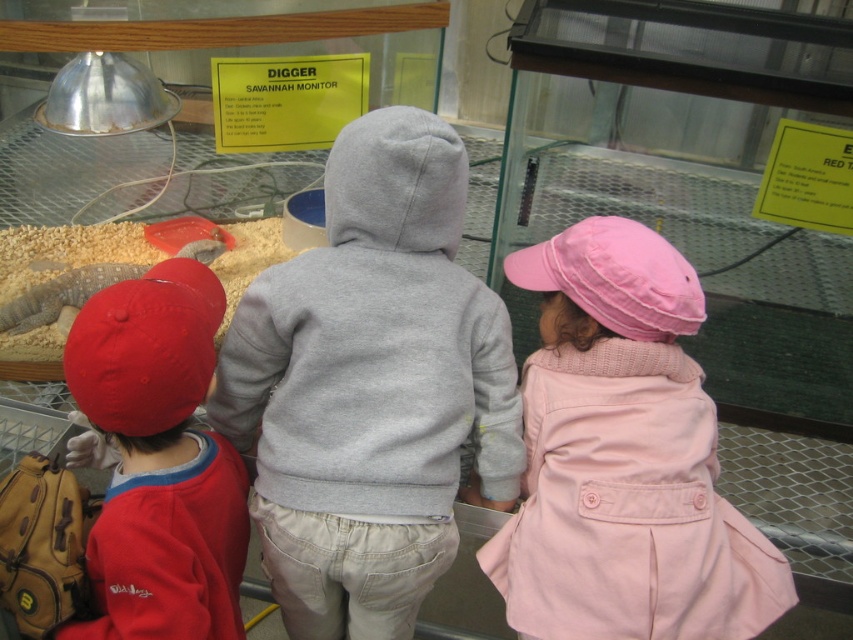
Question: Estimate the real-world distances between objects in this image. Which object is farther from the pink cotton coat at center?

Choices:
 (A) gray fleece hoodie at center
 (B) matte red cap at left

Answer: (B)

Question: Is gray fleece hoodie at center bigger than pink cotton coat at center?

Choices:
 (A) yes
 (B) no

Answer: (A)

Question: Which point is farther from the camera taking this photo?

Choices:
 (A) (543, 592)
 (B) (364, 385)
 (C) (198, 500)

Answer: (B)

Question: Estimate the real-world distances between objects in this image. Which object is farther from the gray fleece hoodie at center?

Choices:
 (A) pink cotton coat at center
 (B) matte red cap at left

Answer: (A)

Question: Can you confirm if gray fleece hoodie at center is bigger than matte red cap at left?

Choices:
 (A) yes
 (B) no

Answer: (A)

Question: Is pink cotton coat at center closer to the viewer compared to matte red cap at left?

Choices:
 (A) no
 (B) yes

Answer: (A)